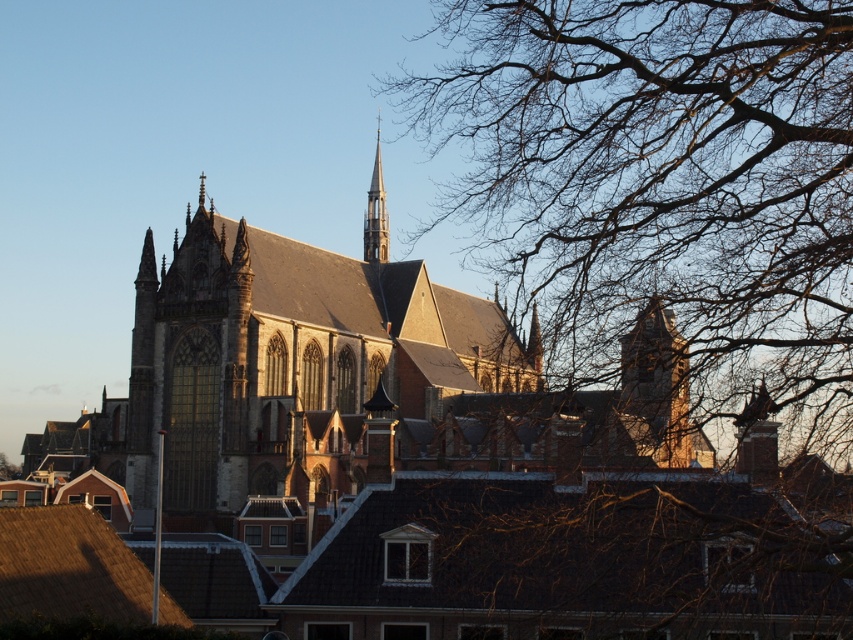
You are standing in front of the Gothic church and want to take a photo that includes both the bare branches at upper right and the smooth gray steeple at center. Which object should you focus on first to ensure both are in sharp focus?

You should focus on the smooth gray steeple at center first because the bare branches at upper right are closer to the viewer, so adjusting focus from the closer object to the farther one will help both be in sharp focus.

You are an architect analyzing the spatial arrangement of the church and its surroundings. Based on the image, which object is positioned lower in the scene between the bare branches at upper right and the smooth gray steeple at center?

The bare branches at upper right is positioned lower than the smooth gray steeple at center in the scene.

You are an architect analyzing the church and its surroundings. From your vantage point, which object occupies a larger portion of the visual field between the bare branches at upper right and the smooth gray steeple at center?

The bare branches at upper right occupy a larger portion of the visual field than the smooth gray steeple at center, as stated in the description that the bare branches at upper right is bigger than smooth gray steeple at center.